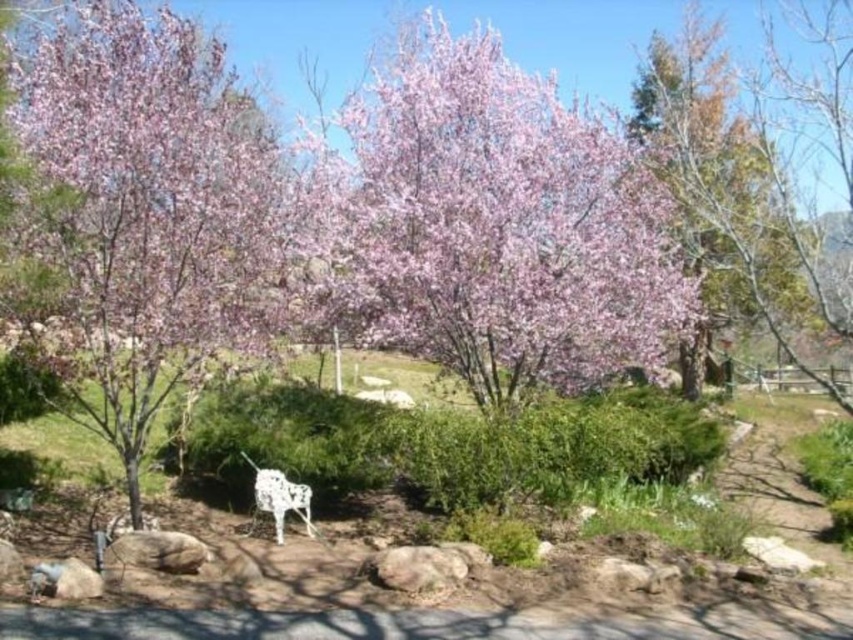
Based on the photo, you are a visitor in a garden with cherry blossom trees. You see a white metallic horse at center and a white metallic chair at center. Which object is closer to the left side of the garden?

The white metallic horse at center is closer to the left side of the garden because it is positioned to the left of the white metallic chair at center.

You are standing at the center of the cherry blossom area and want to find the pink matte flower at upper center. According to the coordinates given, where exactly should you look to locate it?

The pink matte flower at upper center is located at coordinates point (x=502, y=225), so you should look towards the upper center area to find it.

You are planning to place a new white metallic horse at center and a white metallic chair at center in your garden. Given their sizes, which object would require more horizontal space between them to avoid overcrowding?

The white metallic horse at center requires more horizontal space because its width is larger than the white metallic chair at center.